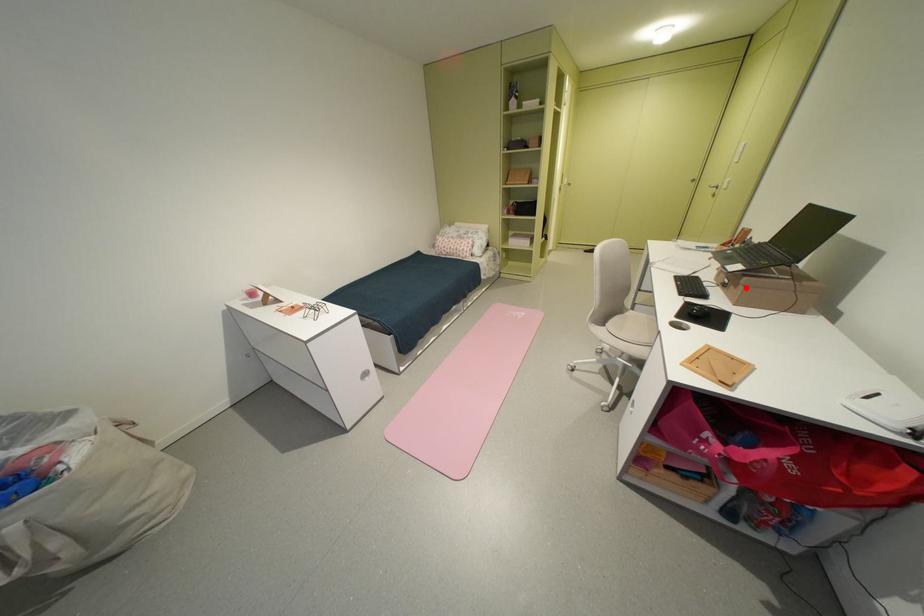
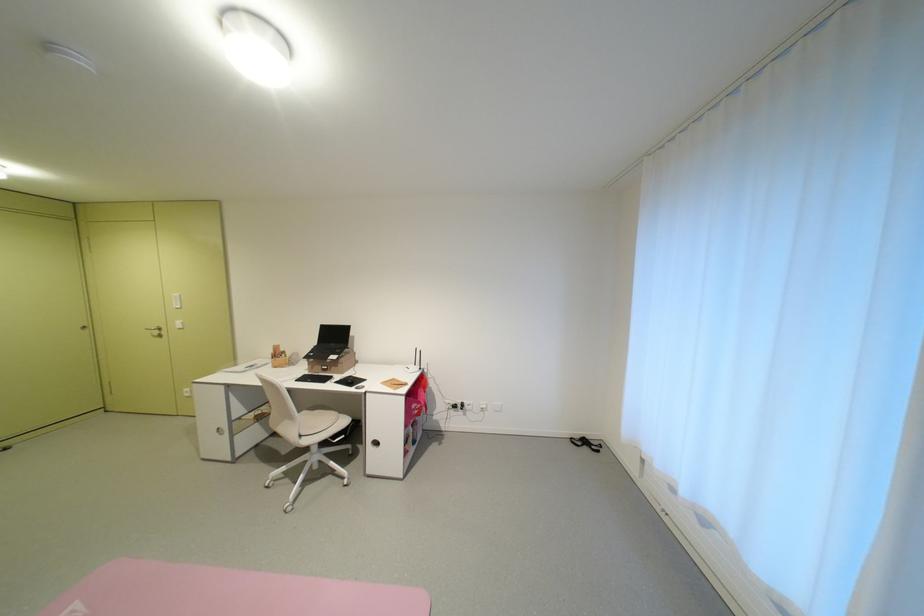
Question: I am providing you with two images of the same scene from different viewpoints. A red point is marked on the first image. Can you still see the location of the red point in image 2?

Choices:
 (A) Yes
 (B) No

Answer: (A)